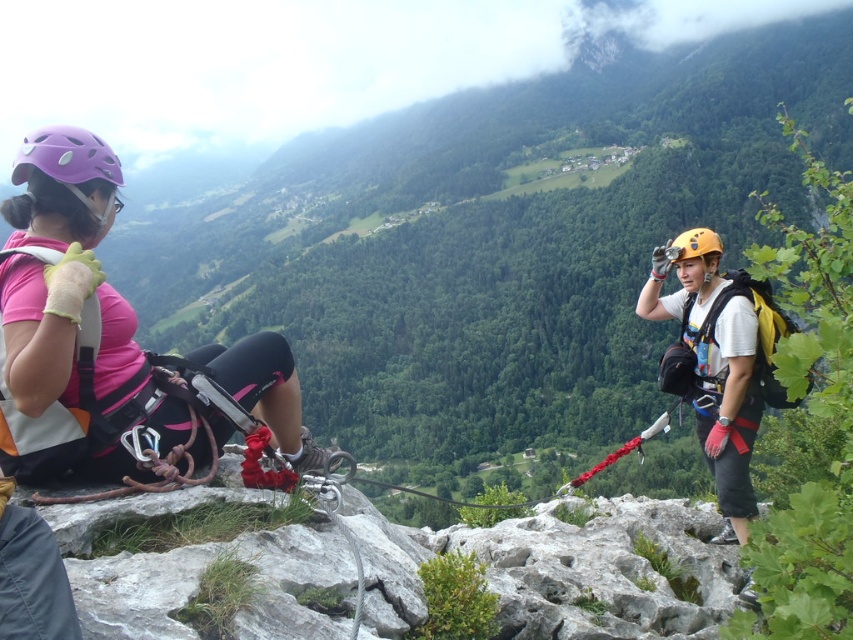
Can you confirm if yellow matte helmet at right is wider than purple matte helmet at left?

No, yellow matte helmet at right is not wider than purple matte helmet at left.

Which is more to the right, yellow matte helmet at right or purple matte helmet at left?

Positioned to the right is yellow matte helmet at right.

The image size is (853, 640). In order to click on yellow matte helmet at right in this screenshot , I will do [x=712, y=358].